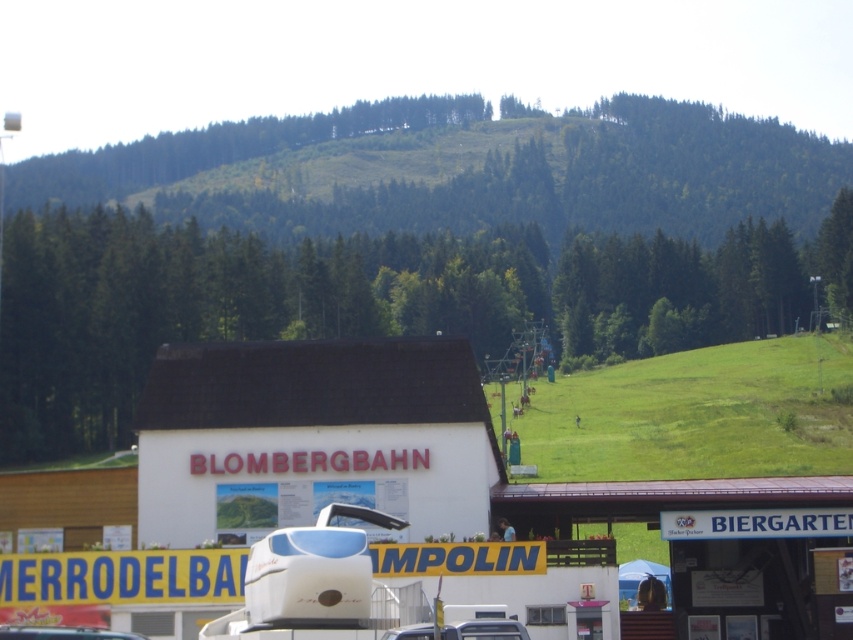
Between white wooden building at lower right and metallic silver car at center, which one appears on the left side from the viewer's perspective?

metallic silver car at center is more to the left.

Between point (805, 621) and point (491, 620), which one is positioned in front?

Positioned in front is point (491, 620).

Which is in front, point (672, 596) or point (457, 625)?

Positioned in front is point (457, 625).

Locate an element on the screen. white wooden building at lower right is located at coordinates (717, 547).

Who is positioned more to the left, white wooden building at lower right or white glossy car at lower center?

white glossy car at lower center is more to the left.

Does point (691, 566) lie in front of point (32, 637)?

No, (691, 566) is behind (32, 637).

Does point (547, 500) come closer to viewer compared to point (6, 636)?

That is False.

Where is `white wooden building at lower right`? Image resolution: width=853 pixels, height=640 pixels. white wooden building at lower right is located at coordinates (717, 547).

Who is positioned more to the left, metallic silver car at center or white glossy car at lower center?

white glossy car at lower center

Who is higher up, metallic silver car at center or white glossy car at lower center?

metallic silver car at center is above.

Is point (514, 637) less distant than point (107, 636)?

Yes, it is in front of point (107, 636).

Locate an element on the screen. The width and height of the screenshot is (853, 640). metallic silver car at center is located at coordinates (485, 628).